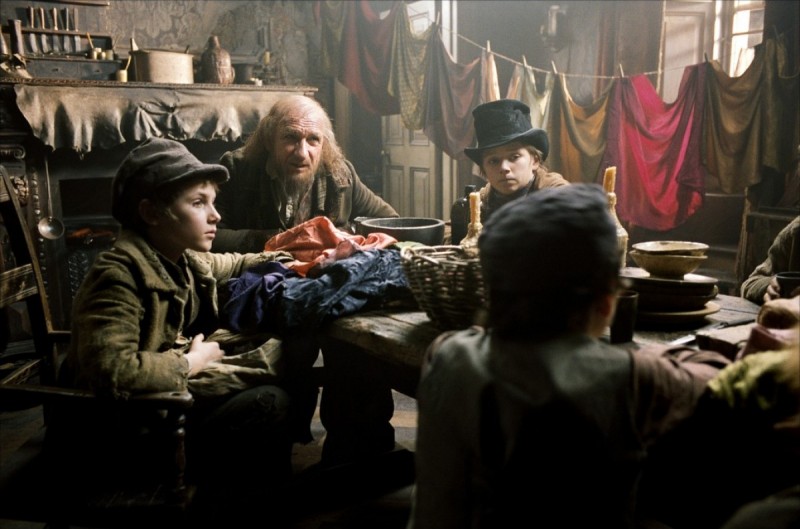
Identify the location of door. The image size is (800, 529). (406, 164).